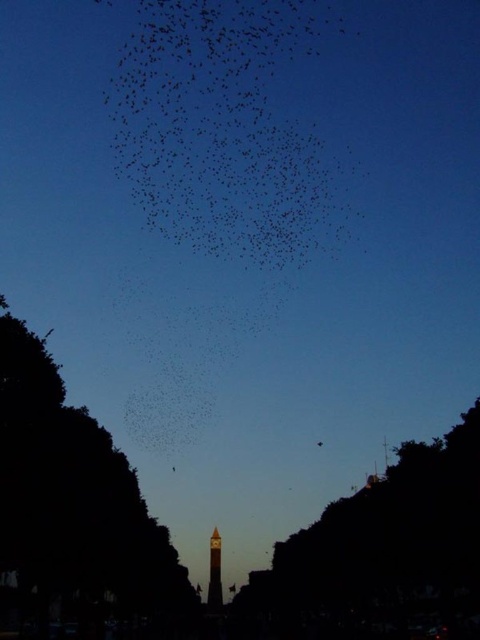
Does dark green leafy tree at left have a lesser width compared to black matte bird at upper center?

No.

Measure the distance between dark green leafy tree at left and black matte bird at upper center.

dark green leafy tree at left and black matte bird at upper center are 83.24 meters apart from each other.

This screenshot has height=640, width=480. Describe the element at coordinates (75, 516) in the screenshot. I see `dark green leafy tree at left` at that location.

Where is `dark green leafy tree at left`? This screenshot has height=640, width=480. dark green leafy tree at left is located at coordinates (75, 516).

Does black matte birds at upper center have a larger size compared to smooth stone bell tower at center?

Correct, black matte birds at upper center is larger in size than smooth stone bell tower at center.

Is black matte birds at upper center closer to the viewer compared to smooth stone bell tower at center?

Yes, black matte birds at upper center is in front of smooth stone bell tower at center.

Where is `black matte birds at upper center`? black matte birds at upper center is located at coordinates (225, 125).

Which is behind, point (60, 561) or point (217, 536)?

The point (217, 536) is behind.

Is point (153, 586) closer to viewer compared to point (216, 547)?

Yes, it is.

The width and height of the screenshot is (480, 640). I want to click on dark green leafy tree at left, so click(x=75, y=516).